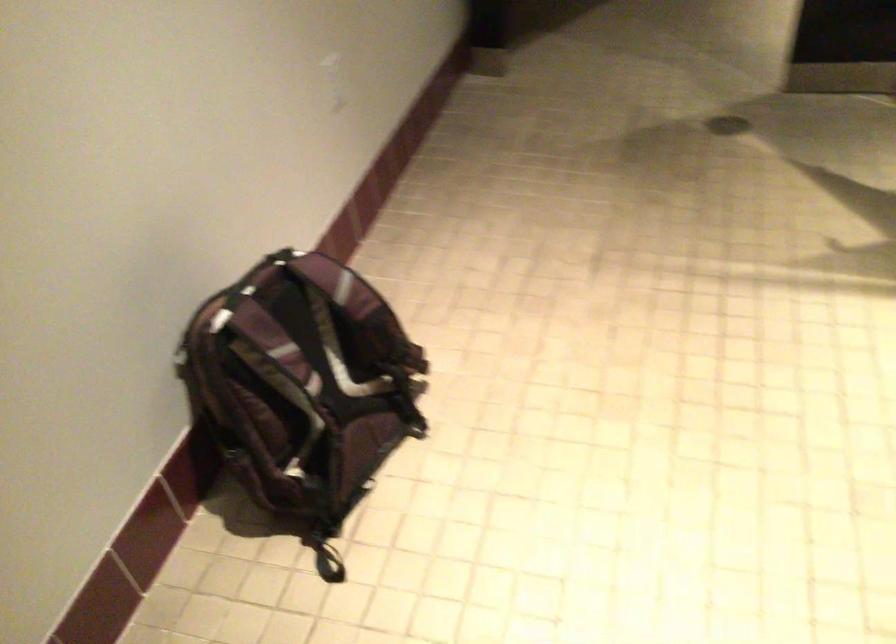
Identify the location of backpack top handle. (393, 393).